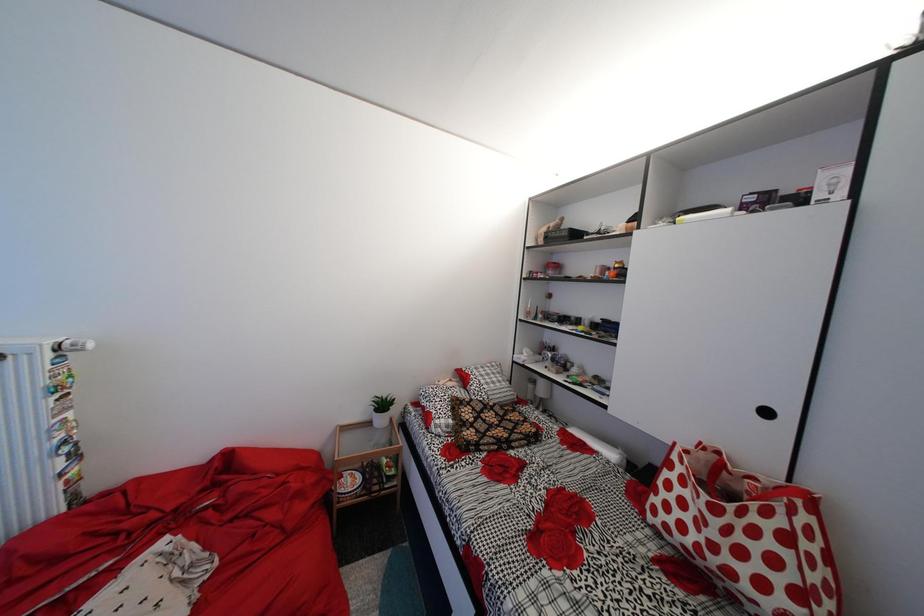
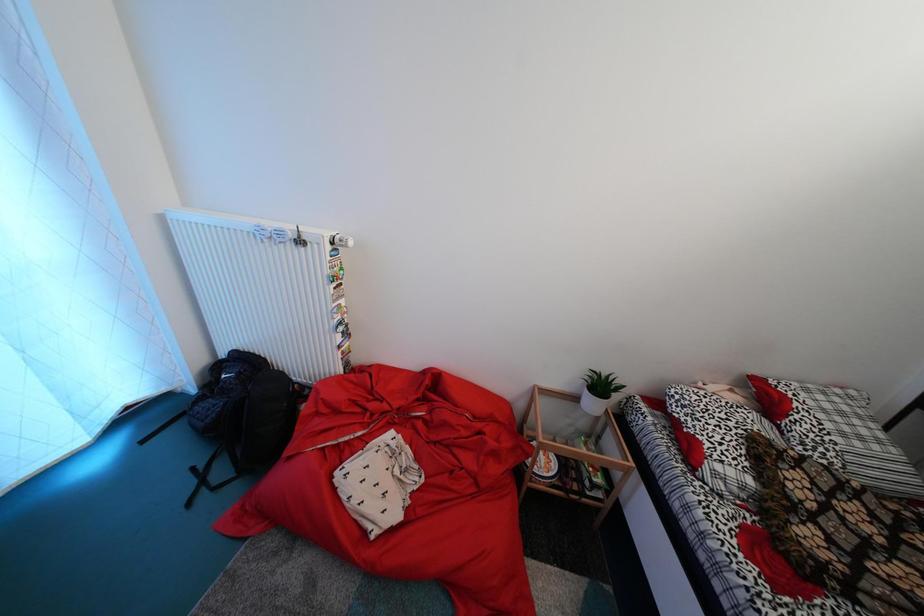
The first image is from the beginning of the video and the second image is from the end. How did the camera likely rotate when shooting the video?

The camera's rotation is toward left-down.